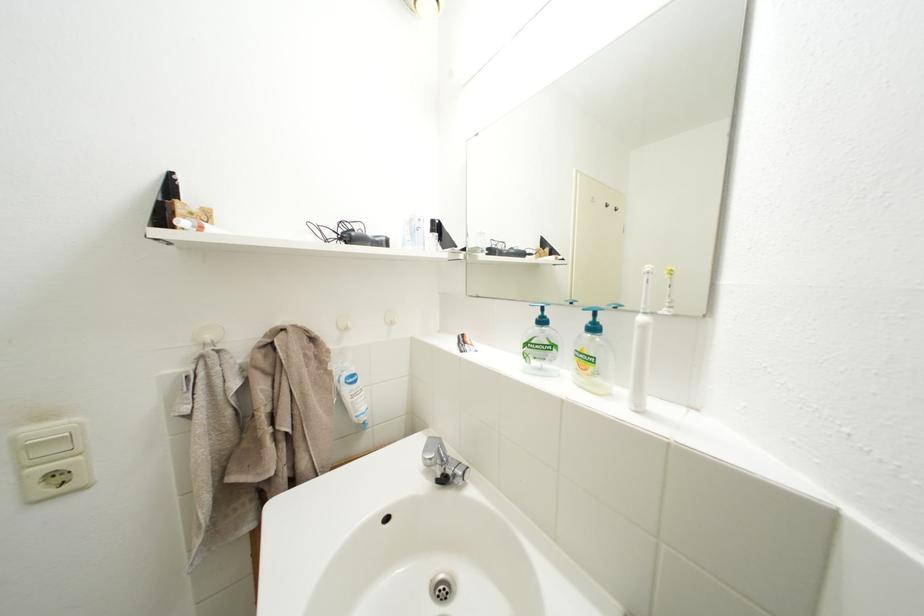
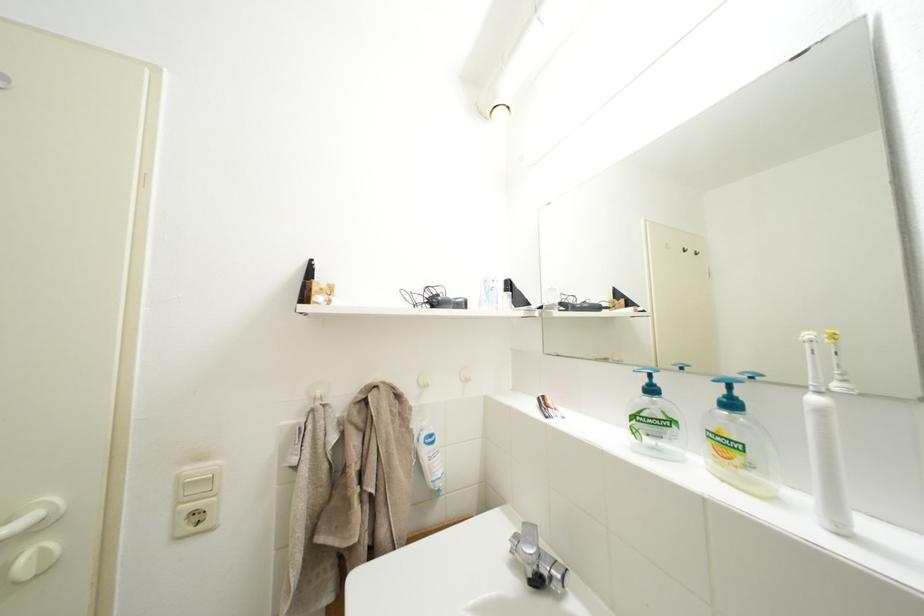
Locate, in the second image, the point that corresponds to the point at 30,484 in the first image.

(185, 519)